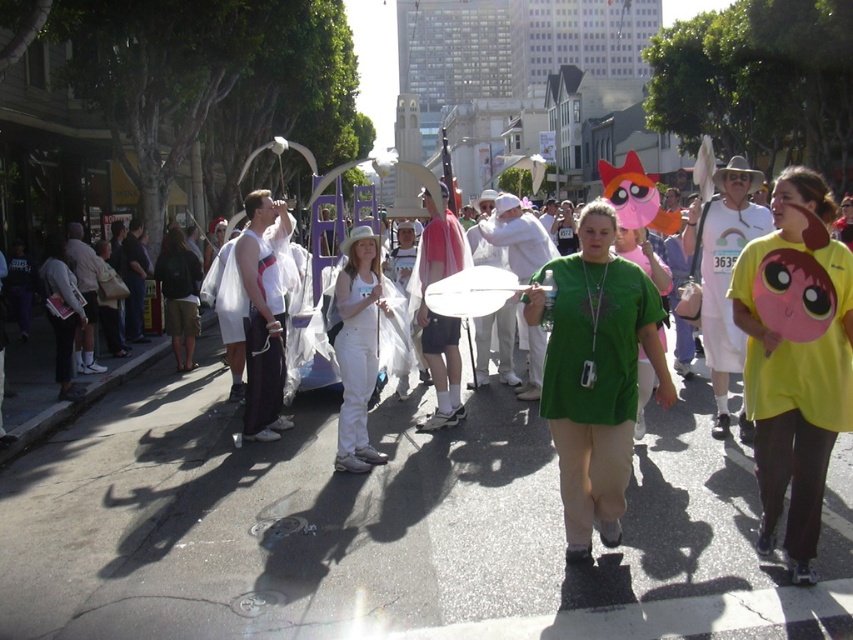
Is green fabric balloon at center thinner than white matte pants at center?

Yes, green fabric balloon at center is thinner than white matte pants at center.

Consider the image. Which is more to the right, green fabric balloon at center or white matte pants at center?

green fabric balloon at center is more to the right.

Is point (498, 576) farther from viewer compared to point (357, 401)?

No, it is not.

Locate an element on the screen. The image size is (853, 640). green fabric balloon at center is located at coordinates (381, 513).